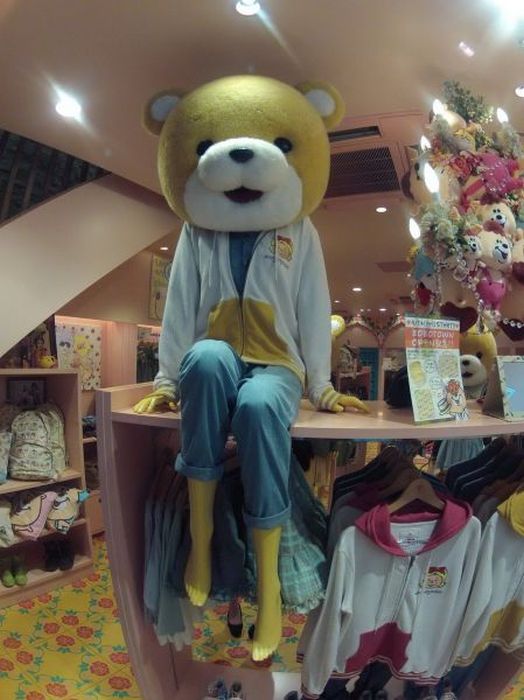
Image resolution: width=524 pixels, height=700 pixels. Identify the location of cupboard. (64, 475).